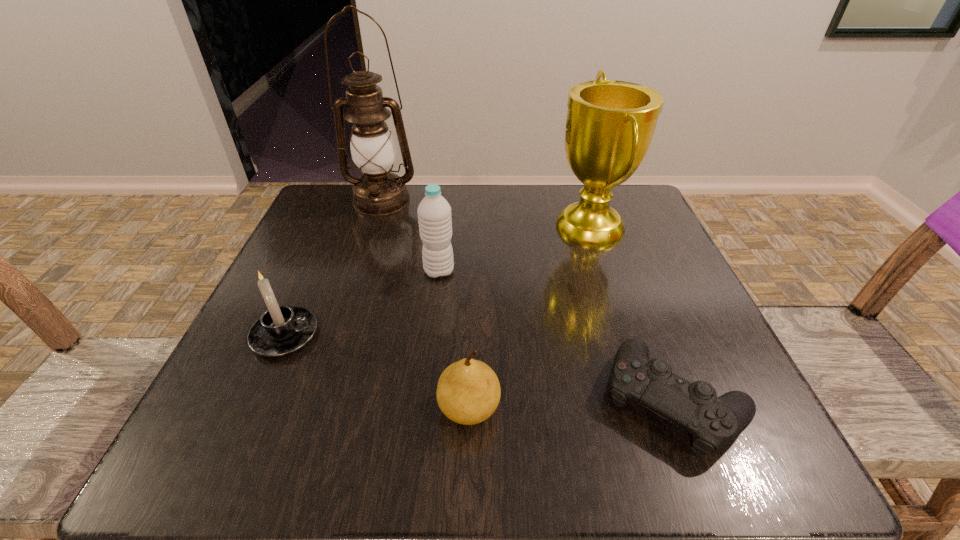
Locate an element on the screen. free space between the tallest object and the pear is located at coordinates (425, 305).

Where is `unoccupied position between the tallest object and the pear`? The height and width of the screenshot is (540, 960). unoccupied position between the tallest object and the pear is located at coordinates (425, 305).

Find the location of a particular element. empty location between the candle holder and the award is located at coordinates (438, 282).

The width and height of the screenshot is (960, 540). Find the location of `blank region between the award and the tallest object`. blank region between the award and the tallest object is located at coordinates (486, 214).

Identify the location of vacant area that lies between the tallest object and the fourth shortest object. pos(410,236).

This screenshot has width=960, height=540. Identify the location of empty space between the oil lamp and the control. (527, 300).

Find the location of a particular element. The height and width of the screenshot is (540, 960). free space between the award and the pear is located at coordinates (530, 318).

Find the location of `empty space that is in between the shortest object and the fourth shortest object`. empty space that is in between the shortest object and the fourth shortest object is located at coordinates (556, 335).

Locate an element on the screen. The image size is (960, 540). object that is the closest to the water bottle is located at coordinates (379, 192).

The width and height of the screenshot is (960, 540). Identify the location of the closest object to the candle holder. (434, 212).